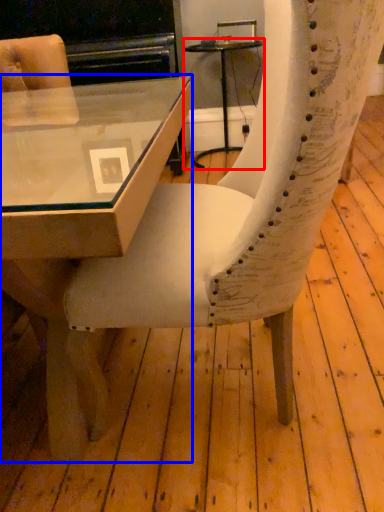
Question: Which of the following is the closest to the observer, table (highlighted by a red box) or table (highlighted by a blue box)?

Choices:
 (A) table
 (B) table

Answer: (B)